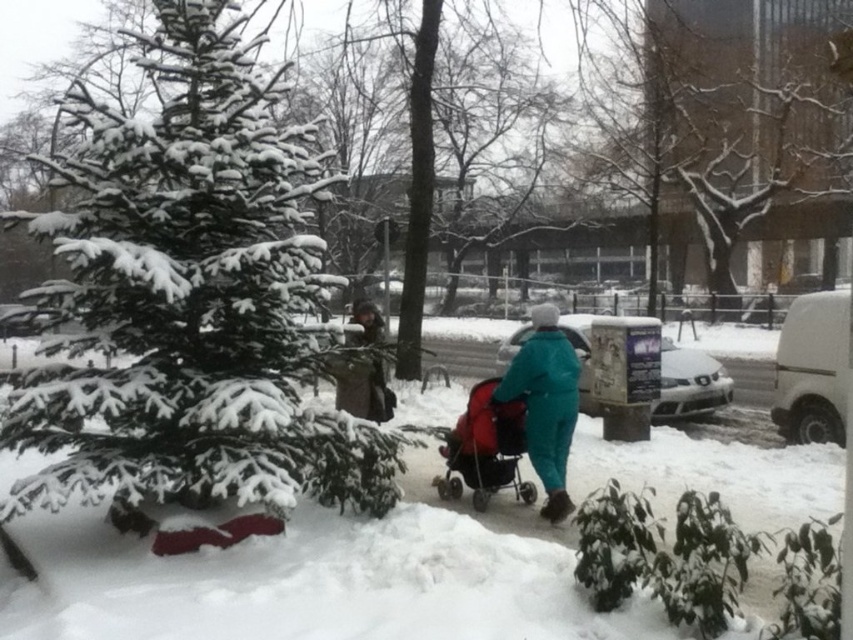
Where is `green matte tree at center`? green matte tree at center is located at coordinates (190, 298).

Between point (155, 461) and point (374, 365), which one is positioned in front?

Point (155, 461) is in front.

The image size is (853, 640). Describe the element at coordinates (190, 298) in the screenshot. I see `green matte tree at center` at that location.

What are the coordinates of `green matte tree at center` in the screenshot? It's located at (190, 298).

Does teal fabric stroller at center come in front of red fabric stroller at center?

Yes, teal fabric stroller at center is in front of red fabric stroller at center.

Is point (556, 396) farther from viewer compared to point (480, 472)?

No.

Is point (558, 456) closer to camera compared to point (467, 440)?

Yes.

At what (x,y) coordinates should I click in order to perform the action: click on teal fabric stroller at center. Please return your answer as a coordinate pair (x, y). This screenshot has width=853, height=640. Looking at the image, I should click on (544, 403).

Which is more to the left, teal fabric stroller at center or brown textured coat at center?

brown textured coat at center

Which is behind, point (554, 460) or point (347, 387)?

Point (347, 387)

This screenshot has height=640, width=853. I want to click on teal fabric stroller at center, so click(544, 403).